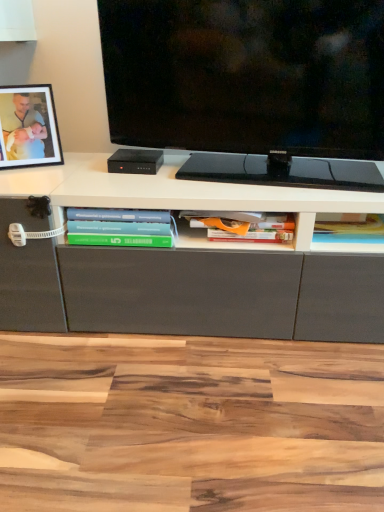
Question: Which direction should I rotate to look at hardcover book at center, which is the first book from right to left?

Choices:
 (A) right
 (B) left

Answer: (A)

Question: Is black matte picture frame at upper left placed right next to orange matte book at center, which ranks as the 2th book in left-to-right order?

Choices:
 (A) yes
 (B) no

Answer: (B)

Question: Is black matte picture frame at upper left not close to orange matte book at center, the second book from the right?

Choices:
 (A) yes
 (B) no

Answer: (B)

Question: From the image's perspective, is black matte picture frame at upper left below orange matte book at center, the second book from the right?

Choices:
 (A) yes
 (B) no

Answer: (B)

Question: Could you tell me if black matte picture frame at upper left is facing orange matte book at center, the second book from the right?

Choices:
 (A) yes
 (B) no

Answer: (B)

Question: Is black matte picture frame at upper left located outside orange matte book at center, which ranks as the 2th book in left-to-right order?

Choices:
 (A) yes
 (B) no

Answer: (A)

Question: Can you confirm if black matte picture frame at upper left is positioned to the left of orange matte book at center, which ranks as the 2th book in left-to-right order?

Choices:
 (A) yes
 (B) no

Answer: (A)

Question: Are hardcover book at center, the third book positioned from the left, and black matte picture frame at upper left located far from each other?

Choices:
 (A) yes
 (B) no

Answer: (B)

Question: Can you see hardcover book at center, the third book positioned from the left, touching black matte picture frame at upper left?

Choices:
 (A) no
 (B) yes

Answer: (A)

Question: Is hardcover book at center, the third book positioned from the left, bigger than black matte picture frame at upper left?

Choices:
 (A) no
 (B) yes

Answer: (A)

Question: Is black matte picture frame at upper left located within hardcover book at center, which is the first book from right to left?

Choices:
 (A) yes
 (B) no

Answer: (B)

Question: Is hardcover book at center, which is the first book from right to left, oriented towards black matte picture frame at upper left?

Choices:
 (A) no
 (B) yes

Answer: (A)

Question: From a real-world perspective, is hardcover book at center, which is the first book from right to left, located beneath black matte picture frame at upper left?

Choices:
 (A) yes
 (B) no

Answer: (A)

Question: Is black glossy tv at center oriented towards green matte book at lower left, marked as the 3th book in a right-to-left arrangement?

Choices:
 (A) no
 (B) yes

Answer: (A)